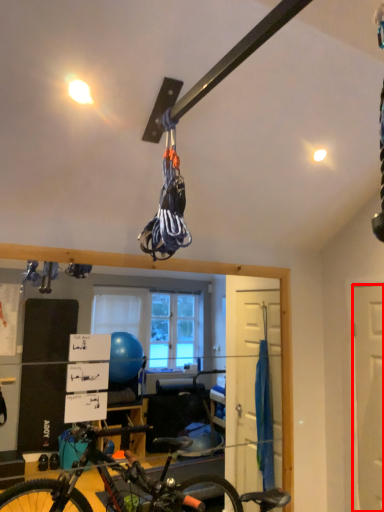
Question: Where is door (annotated by the red box) located in relation to bicycle in the image?

Choices:
 (A) right
 (B) left

Answer: (A)